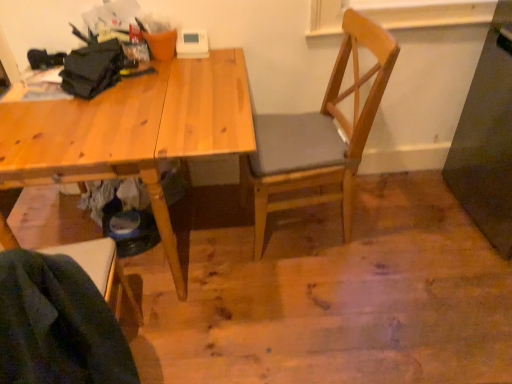
Question: From the image's perspective, is wooden chair at center, the 2th chair from the front, located above or below wooden chair at lower left, acting as the second chair starting from the right?

Choices:
 (A) below
 (B) above

Answer: (B)

Question: Relative to wooden chair at lower left, the first chair in the front-to-back sequence, is wooden chair at center, the 2th chair from the front, in front or behind?

Choices:
 (A) behind
 (B) front

Answer: (A)

Question: Based on their relative distances, which object is nearer to the wooden chair at center, arranged as the 1th chair when viewed from the back?

Choices:
 (A) natural wood desk at upper left
 (B) wooden chair at lower left, which is the 2th chair in back-to-front order

Answer: (A)

Question: Which object is positioned closest to the natural wood desk at upper left?

Choices:
 (A) wooden chair at center, placed as the 1th chair when sorted from right to left
 (B) wooden chair at lower left, the first chair in the front-to-back sequence

Answer: (B)